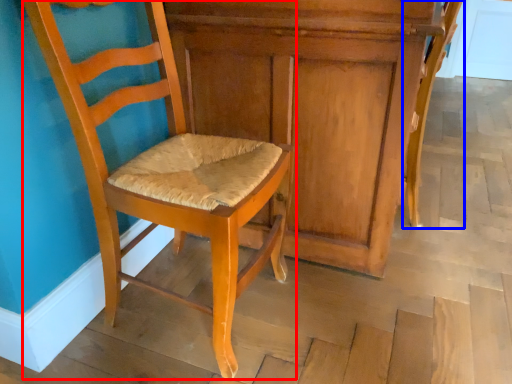
Question: Among these objects, which one is nearest to the camera, chair (highlighted by a red box) or chair (highlighted by a blue box)?

Choices:
 (A) chair
 (B) chair

Answer: (A)